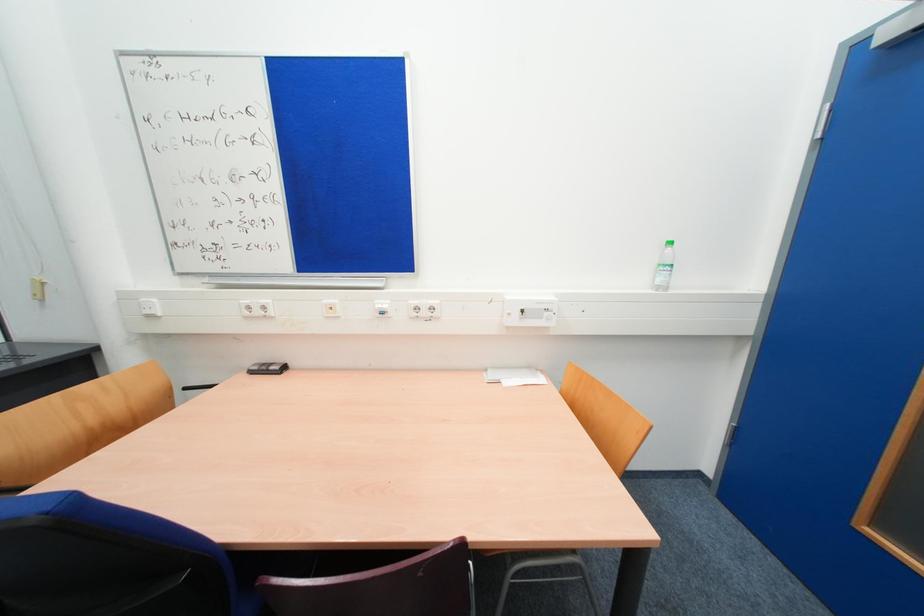
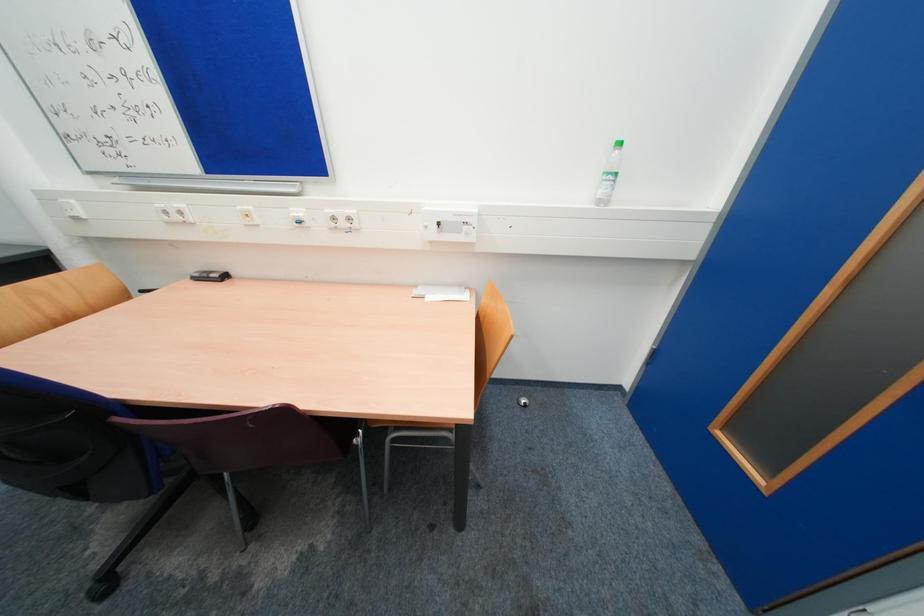
Question: Which direction would the cameraman need to move to produce the second image? Reply with the corresponding letter.

Choices:
 (A) Left
 (B) Right
 (C) Forward
 (D) Backward

Answer: (B)